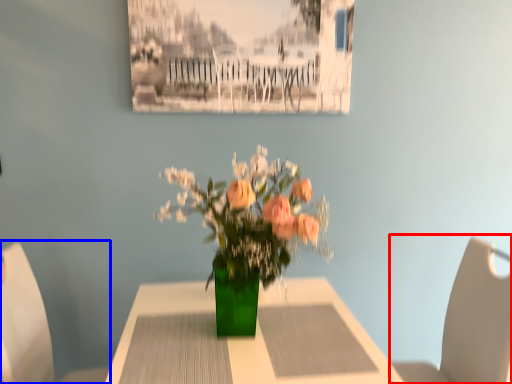
Question: Among these objects, which one is farthest to the camera, chair (highlighted by a red box) or chair (highlighted by a blue box)?

Choices:
 (A) chair
 (B) chair

Answer: (A)